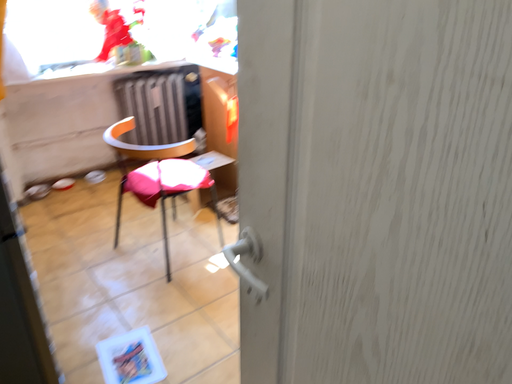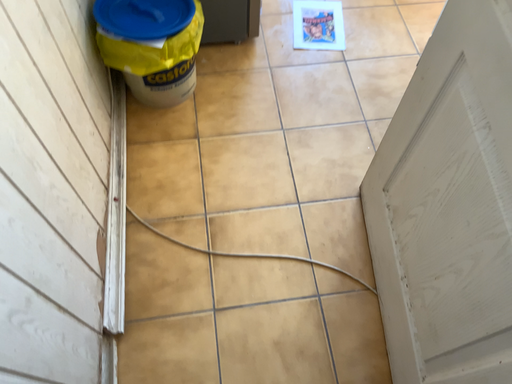
Question: How did the camera likely rotate when shooting the video?

Choices:
 (A) rotated left
 (B) rotated right

Answer: (A)